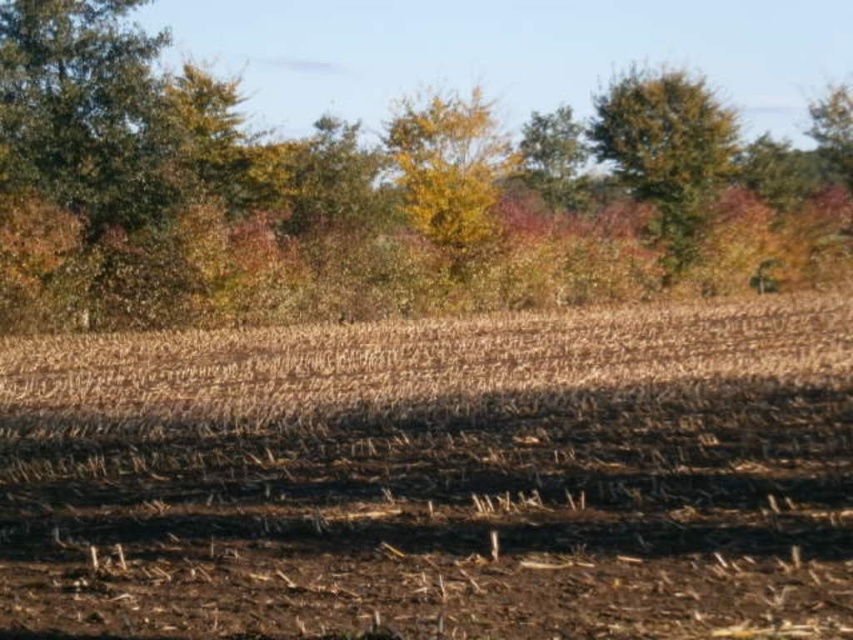
You are standing in a rural landscape and see the brown soil at center and the green leafy tree at upper center. Which object is positioned to the left of the other?

The brown soil at center is to the left of the green leafy tree at upper center.

You are a farmer planning to plant new crops. You notice the brown soil at center and the green leafy tree at upper center in the image. Which area has more space available for planting?

The brown soil at center has less space available for planting compared to the green leafy tree at upper center, as the brown soil at center occupies less space than the green leafy tree at upper center.